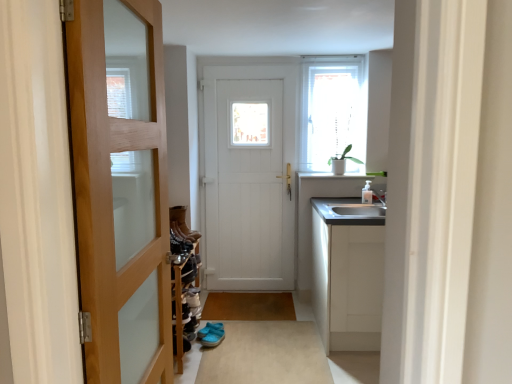
Question: From the image's perspective, does wooden door at left, acting as the 2th door starting from the back, appear lower than white wooden door at center, the second door from the front?

Choices:
 (A) no
 (B) yes

Answer: (B)

Question: Considering the relative sizes of wooden door at left, acting as the 2th door starting from the back, and white wooden door at center, which appears as the first door when viewed from the back, in the image provided, is wooden door at left, acting as the 2th door starting from the back, shorter than white wooden door at center, which appears as the first door when viewed from the back,?

Choices:
 (A) no
 (B) yes

Answer: (B)

Question: Does wooden door at left, placed as the first door when sorted from front to back, have a larger size compared to white wooden door at center, the second door from the front?

Choices:
 (A) yes
 (B) no

Answer: (A)

Question: Is wooden door at left, acting as the 2th door starting from the back, closer to the viewer compared to white wooden door at center, which appears as the first door when viewed from the back?

Choices:
 (A) no
 (B) yes

Answer: (B)

Question: Would you say white wooden door at center, which appears as the first door when viewed from the back, is part of wooden door at left, acting as the 2th door starting from the back,'s contents?

Choices:
 (A) no
 (B) yes

Answer: (A)

Question: Is leather boots at center taller or shorter than white wooden door at center, which appears as the first door when viewed from the back?

Choices:
 (A) short
 (B) tall

Answer: (A)

Question: Choose the correct answer: Is leather boots at center inside white wooden door at center, which appears as the first door when viewed from the back, or outside it?

Choices:
 (A) inside
 (B) outside

Answer: (B)

Question: Considering the positions of leather boots at center and white wooden door at center, the second door from the front, in the image, is leather boots at center wider or thinner than white wooden door at center, the second door from the front,?

Choices:
 (A) wide
 (B) thin

Answer: (A)

Question: Considering the relative positions of leather boots at center and white wooden door at center, which appears as the first door when viewed from the back, in the image provided, is leather boots at center to the left or to the right of white wooden door at center, which appears as the first door when viewed from the back,?

Choices:
 (A) left
 (B) right

Answer: (A)

Question: Is leather boots at center bigger or smaller than blue fabric sandals at center?

Choices:
 (A) small
 (B) big

Answer: (B)

Question: Relative to blue fabric sandals at center, is leather boots at center in front or behind?

Choices:
 (A) front
 (B) behind

Answer: (B)

Question: Considering the relative positions of leather boots at center and blue fabric sandals at center in the image provided, is leather boots at center to the left or to the right of blue fabric sandals at center?

Choices:
 (A) right
 (B) left

Answer: (B)

Question: From their relative heights in the image, would you say leather boots at center is taller or shorter than blue fabric sandals at center?

Choices:
 (A) short
 (B) tall

Answer: (B)

Question: Is point (172, 226) positioned closer to the camera than point (140, 178)?

Choices:
 (A) farther
 (B) closer

Answer: (B)

Question: Is leather boots at center in front of or behind wooden door at left, placed as the first door when sorted from front to back, in the image?

Choices:
 (A) front
 (B) behind

Answer: (B)